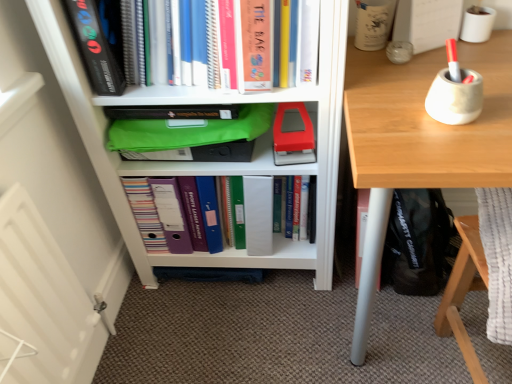
Locate an element on the screen. The width and height of the screenshot is (512, 384). vacant area that lies in front of white matte mug at upper right, which ranks as the 4th stationery in right-to-left order is located at coordinates (379, 77).